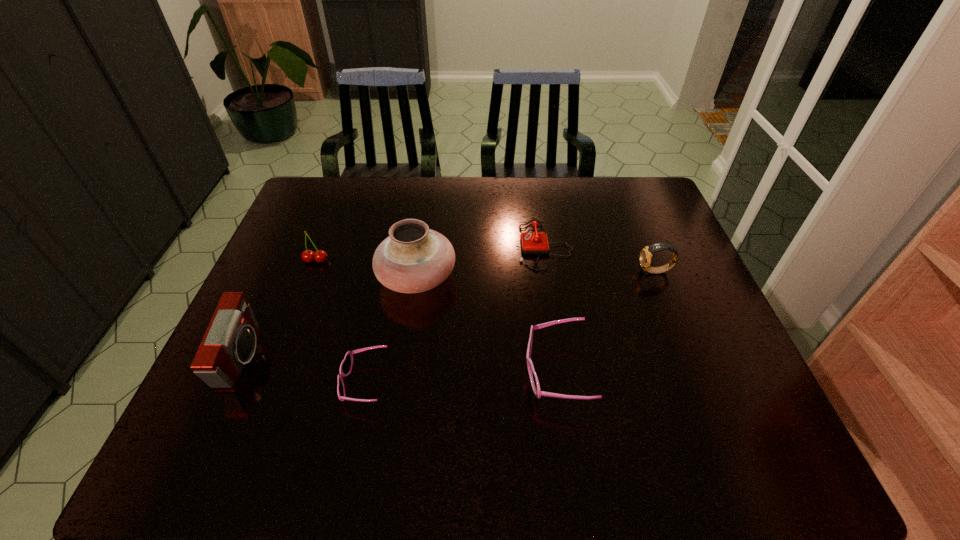
In the image, there is a desktop. Where is `vacant space at the far edge`? Image resolution: width=960 pixels, height=540 pixels. vacant space at the far edge is located at coordinates (532, 201).

At what (x,y) coordinates should I click in order to perform the action: click on vacant point at the near edge. Please return your answer as a coordinate pair (x, y). This screenshot has height=540, width=960. Looking at the image, I should click on (609, 388).

In the image, there is a desktop. Identify the location of vacant space at the left edge. The height and width of the screenshot is (540, 960). (291, 245).

Locate an element on the screen. free point at the right edge is located at coordinates (669, 350).

The height and width of the screenshot is (540, 960). In order to click on vacant area at the far right corner in this screenshot , I will do `click(643, 214)`.

Find the location of a particular element. This screenshot has width=960, height=540. free space that is in between the telephone and the rightmost object is located at coordinates (600, 258).

Find the location of `free space that is in between the cherry and the camera`. free space that is in between the cherry and the camera is located at coordinates (279, 309).

Identify the location of vacant space that is in between the right sunglasses and the tallest object. The height and width of the screenshot is (540, 960). (487, 325).

This screenshot has width=960, height=540. In order to click on unoccupied position between the taller sunglasses and the cherry in this screenshot , I will do `click(436, 316)`.

Locate an element on the screen. free space between the leftmost object and the shortest object is located at coordinates (303, 370).